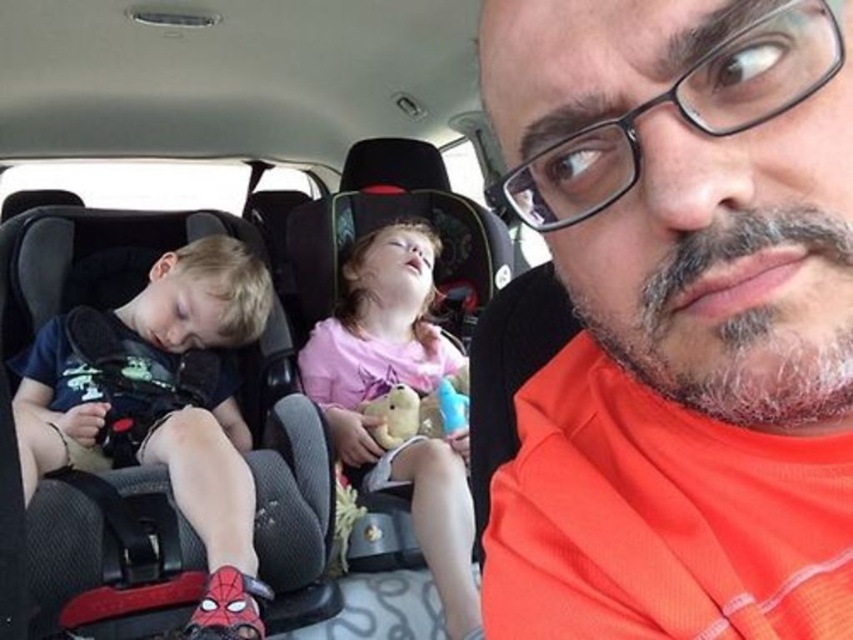
You are a photographer taking a picture of the orange fabric shirt at upper right and the fluffy beige teddy bear at center. Which object should you focus on first to ensure both are in clear view?

The orange fabric shirt at upper right is closer to the viewer than the fluffy beige teddy bear at center, so focus on the orange fabric shirt at upper right first to ensure both are in clear view.

You are a photographer taking a picture of the orange fabric shirt at upper right and the fluffy beige teddy bear at center. Which object should you zoom in on to ensure both fit in the frame without cropping?

The orange fabric shirt at upper right is wider than the fluffy beige teddy bear at center, so you should zoom in on the orange fabric shirt at upper right to ensure both fit in the frame without cropping.